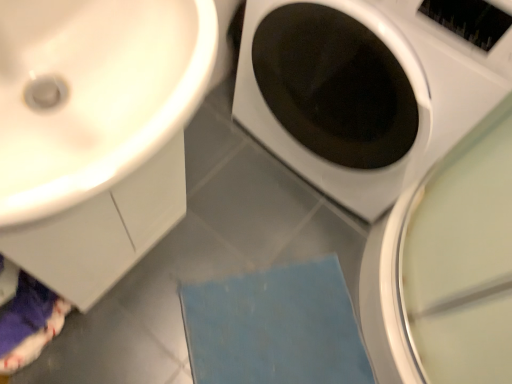
Question: In the image, is white glossy washing machine at center positioned in front of or behind blue fabric bath mat at lower center?

Choices:
 (A) behind
 (B) front

Answer: (B)

Question: In the image, is white glossy washing machine at center on the left side or the right side of blue fabric bath mat at lower center?

Choices:
 (A) left
 (B) right

Answer: (B)

Question: Which object is positioned closest to the blue fabric bath mat at lower center?

Choices:
 (A) white glossy sink at upper left
 (B) white glossy washing machine at center

Answer: (B)

Question: Which object is the closest to the white glossy washing machine at center?

Choices:
 (A) white glossy sink at upper left
 (B) blue fabric bath mat at lower center

Answer: (A)